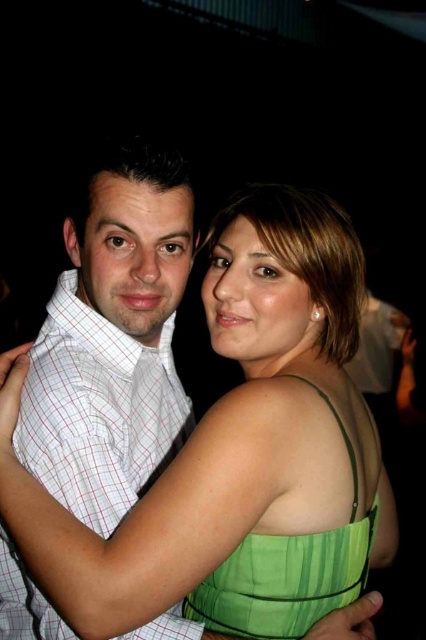
You are a photographer setting up a shoot. You need to ensure that the green satin dress at center and the white checkered shirt at center are both visible in the final photo. Based on their positioning, which clothing item will appear in front of the other?

The green satin dress at center is positioned over the white checkered shirt at center, so it will appear in front of the shirt in the photo.

Based on the scene description, where is the white checkered shirt at center located in terms of coordinates?

The white checkered shirt at center is located at coordinates point (97, 410).

You are a photographer standing at a certain distance from the green satin dress at center. If you want to capture the dress clearly in your photo, would you need to adjust your camera focus to be closer or farther than 30.14 inches?

The green satin dress at center is 30.14 inches away from the viewer. To capture it clearly, the camera focus should be set exactly at 30.14 inches, neither closer nor farther.